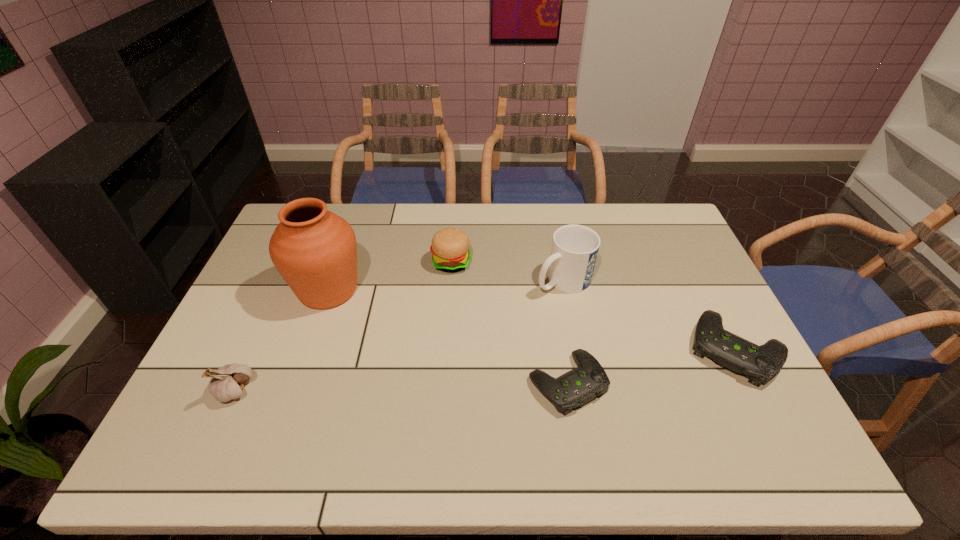
In order to click on free space at the far edge in this screenshot , I will do `click(541, 207)`.

Identify the location of free space at the near edge. (663, 417).

Find the location of a particular element. This screenshot has width=960, height=540. vacant position at the far right corner of the desktop is located at coordinates (665, 204).

The width and height of the screenshot is (960, 540). In order to click on unoccupied area between the fifth shortest object and the tallest object in this screenshot , I will do `click(445, 285)`.

What are the coordinates of `free spot between the tallest object and the third object from left to right` in the screenshot? It's located at (390, 276).

The height and width of the screenshot is (540, 960). What are the coordinates of `free spot between the garlic and the left control` in the screenshot? It's located at (401, 386).

Where is `free space between the garlic and the urn`? free space between the garlic and the urn is located at coordinates (281, 340).

Where is `vacant area between the garlic and the fourth object from right to left`? vacant area between the garlic and the fourth object from right to left is located at coordinates (343, 326).

The image size is (960, 540). What are the coordinates of `unoccupied position between the second tallest object and the urn` in the screenshot? It's located at (445, 285).

Find the location of `free space that is in between the second shortest object and the garlic`. free space that is in between the second shortest object and the garlic is located at coordinates (485, 369).